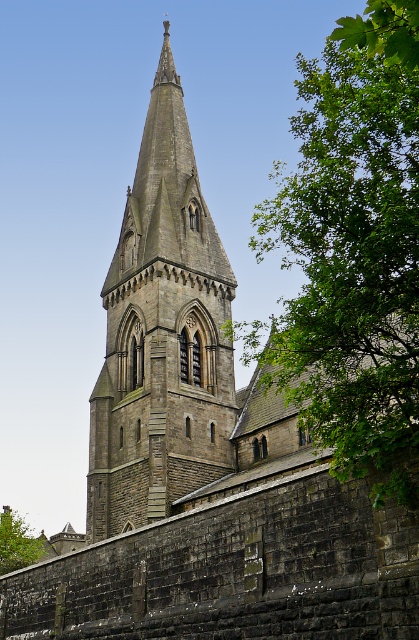
Question: Estimate the real-world distances between objects in this image. Which object is closer to the green leafy tree at upper right?

Choices:
 (A) gray stone tower at center
 (B) green leafy tree at lower left

Answer: (A)

Question: Which object is the closest to the green leafy tree at lower left?

Choices:
 (A) green leafy tree at upper right
 (B) gray stone tower at center

Answer: (B)

Question: Is gray stone tower at center further to camera compared to green leafy tree at lower left?

Choices:
 (A) no
 (B) yes

Answer: (A)

Question: Among these objects, which one is nearest to the camera?

Choices:
 (A) gray stone tower at center
 (B) green leafy tree at lower left
 (C) green leafy tree at upper right

Answer: (C)

Question: Is green leafy tree at upper right wider than green leafy tree at lower left?

Choices:
 (A) no
 (B) yes

Answer: (B)

Question: Does green leafy tree at upper right have a larger size compared to green leafy tree at lower left?

Choices:
 (A) yes
 (B) no

Answer: (A)